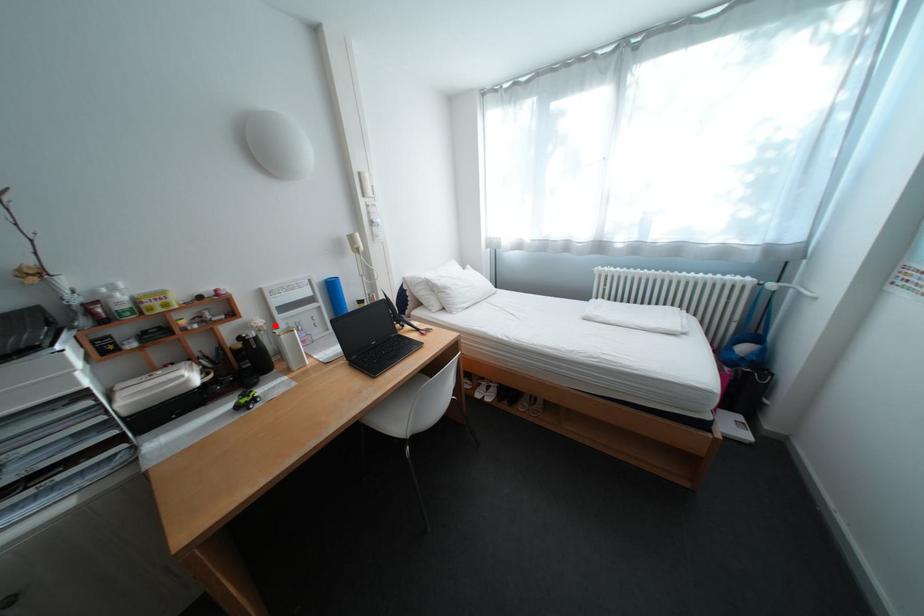
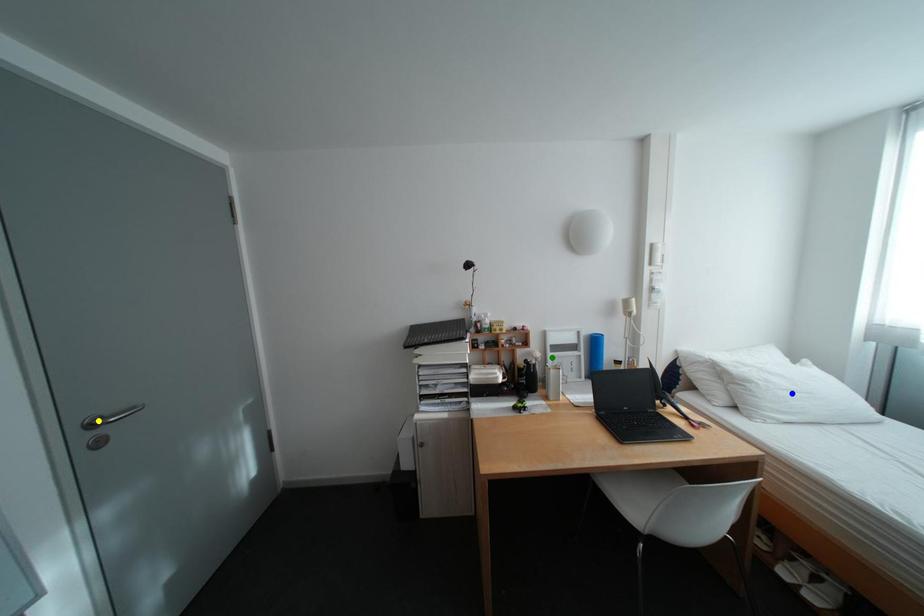
Question: I am providing you with two images of the same scene from different viewpoints. A red point is marked on the first image. You are given multiple points on the second image. In image 2, which mark is for the same physical point as the one in image 1?

Choices:
 (A) yellow point
 (B) blue point
 (C) green point

Answer: (C)